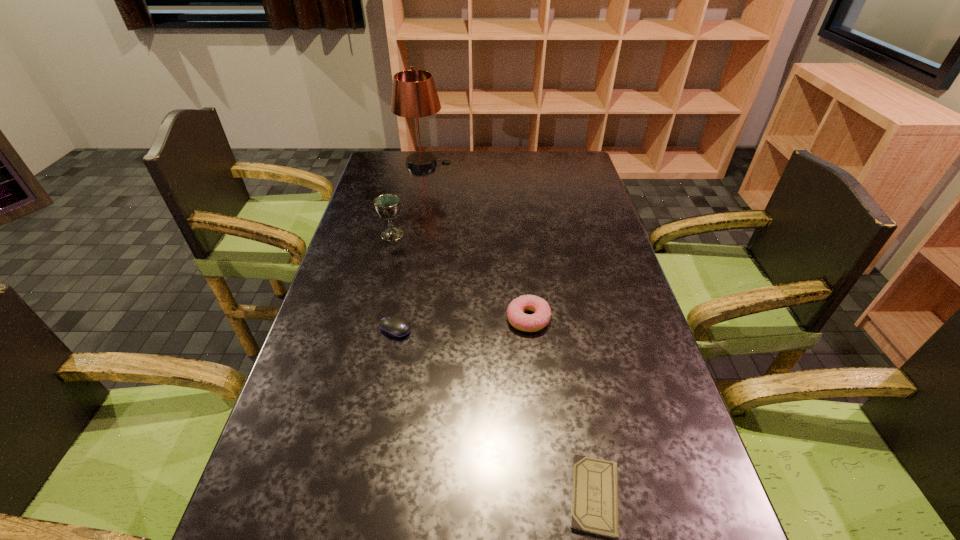
Identify the location of the farthest object. (414, 95).

I want to click on lampshade, so click(x=414, y=95).

The width and height of the screenshot is (960, 540). I want to click on the second tallest object, so click(387, 206).

This screenshot has width=960, height=540. What are the coordinates of `the fourth nearest object` in the screenshot? It's located at [x=387, y=206].

The width and height of the screenshot is (960, 540). Identify the location of the third tallest object. (517, 318).

The image size is (960, 540). Identify the location of computer mouse. (395, 326).

The image size is (960, 540). What are the coordinates of `the nearest object` in the screenshot? It's located at (594, 505).

The width and height of the screenshot is (960, 540). What are the coordinates of `checkbook` in the screenshot? It's located at (594, 505).

I want to click on vacant space located on the front-facing side of the tallest object, so [537, 164].

You are a GUI agent. You are given a task and a screenshot of the screen. Output one action in this format:
    pyautogui.click(x=<x>, y=<y>)
    Task: Click on the vacant space located on the back of the second farthest object
    
    Given the screenshot: What is the action you would take?
    click(406, 179)